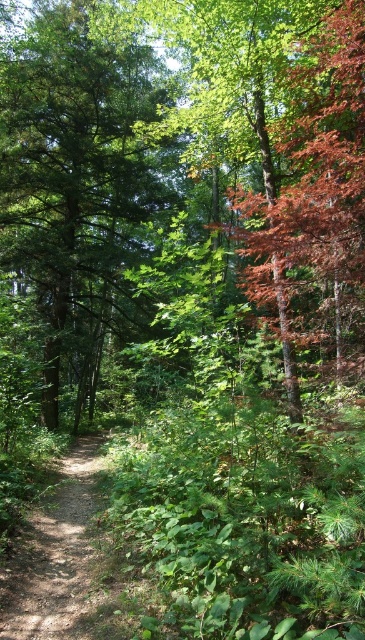
Based on the photo, who is taller, green matte tree at center or dirt path at center?

Standing taller between the two is green matte tree at center.

The image size is (365, 640). I want to click on green matte tree at center, so click(x=74, y=177).